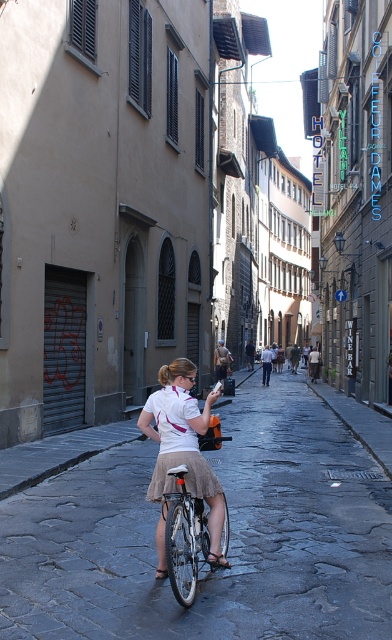
You are a photographer standing in the middle of the cobblestone street. You want to take a photo of the white matte skirt at center and the silver metallic bicycle at center. Which object should you focus on first if you want to capture both in the frame without moving the camera?

The white matte skirt at center is shorter than the silver metallic bicycle at center, so you should focus on the silver metallic bicycle at center first to ensure both are in focus since it is taller and requires more depth of field.

You are a delivery person who needs to pass through the narrow cobblestone street. You see a white matte skirt at center and a silver metallic bicycle at center. Which object takes up more space horizontally?

The silver metallic bicycle at center takes up more horizontal space than the white matte skirt at center because the white matte skirt at center is thinner than the silver metallic bicycle at center.

You are a photographer standing at the end of the cobblestone street. You want to take a closeup shot of the white fabric skirt at center. Considering your camera can focus on objects within 3 meters, will you be able to capture a clear closeup?

The white fabric skirt at center is 4.03 meters away from the camera, which is beyond the 3 meters focusing range. Therefore, you cannot capture a clear closeup.